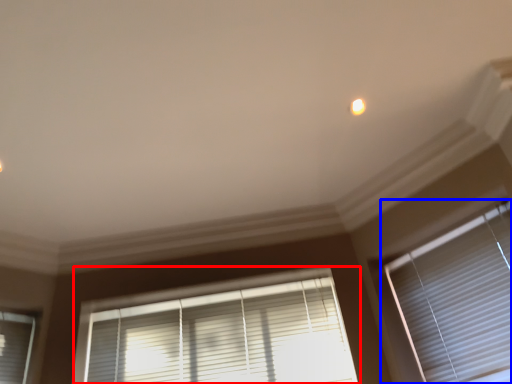
Question: Which object appears closest to the camera in this image, window blind (highlighted by a red box) or window blind (highlighted by a blue box)?

Choices:
 (A) window blind
 (B) window blind

Answer: (B)